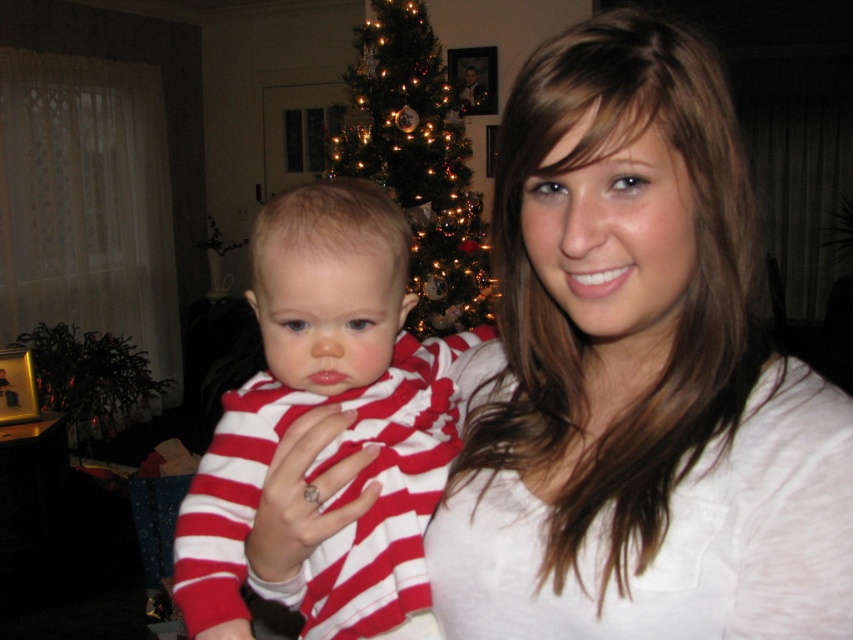
The width and height of the screenshot is (853, 640). I want to click on white matte shirt at center, so click(x=636, y=376).

Is white matte shirt at center to the right of red striped shirt at center from the viewer's perspective?

Indeed, white matte shirt at center is positioned on the right side of red striped shirt at center.

What do you see at coordinates (636, 376) in the screenshot? This screenshot has width=853, height=640. I see `white matte shirt at center` at bounding box center [636, 376].

I want to click on white matte shirt at center, so click(636, 376).

Is white matte shirt at center wider than iridescent glass ornaments at center?

Incorrect, white matte shirt at center's width does not surpass iridescent glass ornaments at center's.

Who is taller, white matte shirt at center or iridescent glass ornaments at center?

iridescent glass ornaments at center is taller.

Is point (547, 516) behind point (366, 109)?

That is False.

The image size is (853, 640). I want to click on white matte shirt at center, so click(x=636, y=376).

Between red striped shirt at center and iridescent glass ornaments at center, which one has less height?

red striped shirt at center is shorter.

You are a GUI agent. You are given a task and a screenshot of the screen. Output one action in this format:
    pyautogui.click(x=<x>, y=<y>)
    Task: Click on the red striped shirt at center
    
    Given the screenshot: What is the action you would take?
    pyautogui.click(x=322, y=403)

Locate an element on the screen. The image size is (853, 640). red striped shirt at center is located at coordinates (322, 403).